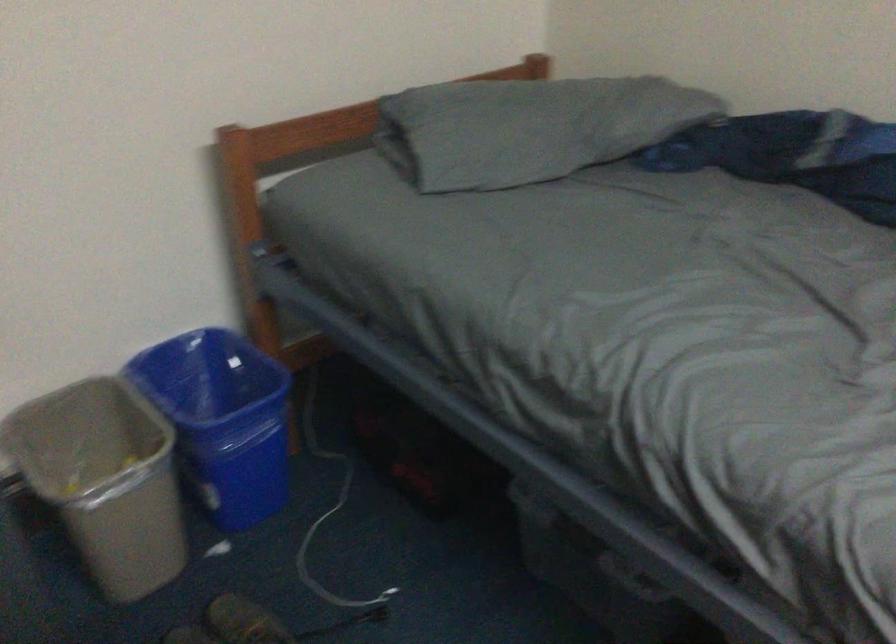
This screenshot has height=644, width=896. What are the coordinates of `grey pillow` in the screenshot? It's located at (529, 128).